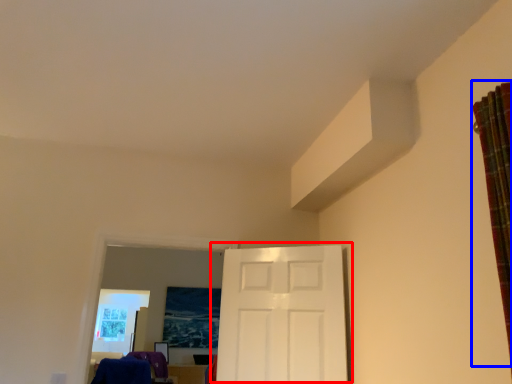
Question: Which object is further to the camera taking this photo, door (highlighted by a red box) or curtain (highlighted by a blue box)?

Choices:
 (A) door
 (B) curtain

Answer: (A)